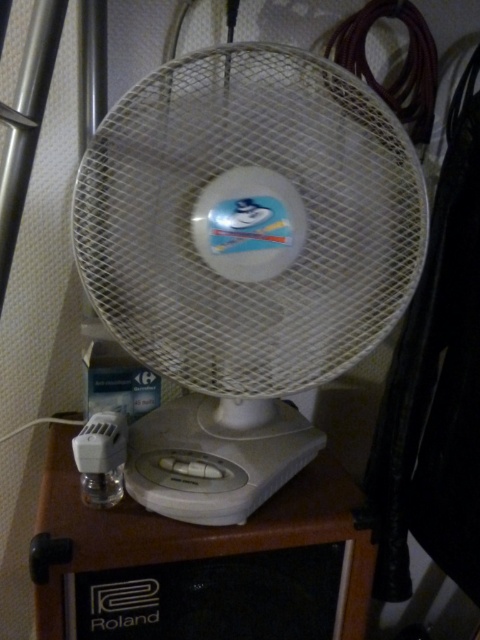
Question: Which point is farther to the camera?

Choices:
 (A) (165, 605)
 (B) (351, 291)

Answer: (A)

Question: Is white plastic fan at center positioned before brown wood table at lower center?

Choices:
 (A) yes
 (B) no

Answer: (A)

Question: Considering the relative positions of white plastic fan at center and brown wood table at lower center in the image provided, where is white plastic fan at center located with respect to brown wood table at lower center?

Choices:
 (A) below
 (B) above

Answer: (B)

Question: Is white plastic fan at center to the right of brown wood table at lower center from the viewer's perspective?

Choices:
 (A) yes
 (B) no

Answer: (A)

Question: Which object appears farthest from the camera in this image?

Choices:
 (A) white plastic fan at center
 (B) brown wood table at lower center

Answer: (B)

Question: Among these objects, which one is farthest from the camera?

Choices:
 (A) white plastic fan at center
 (B) brown wood table at lower center

Answer: (B)